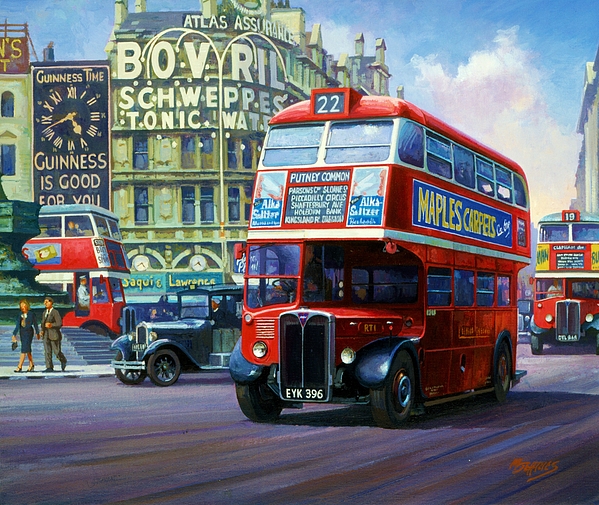
The width and height of the screenshot is (599, 505). I want to click on stairs, so click(x=84, y=359), click(x=83, y=337), click(x=69, y=333), click(x=84, y=345), click(x=92, y=349).